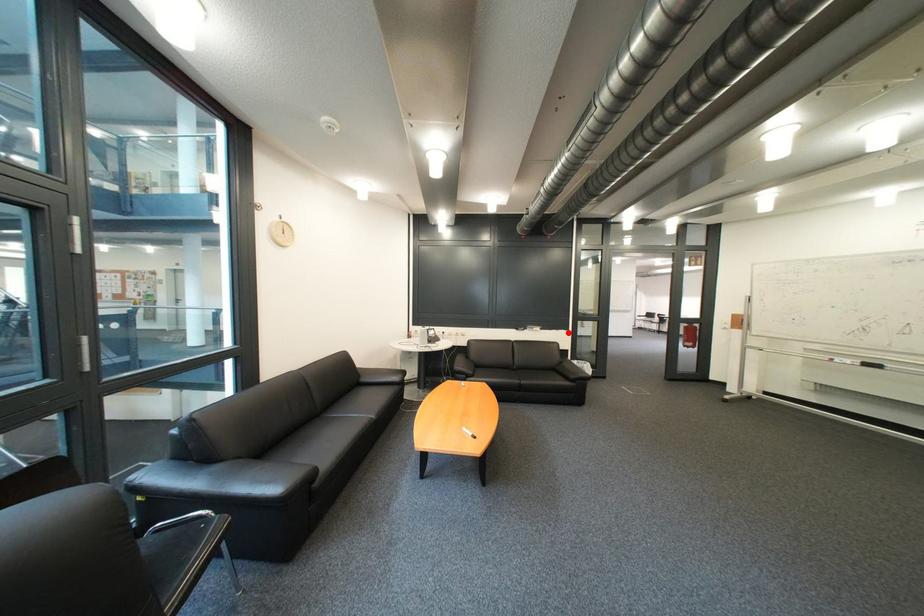
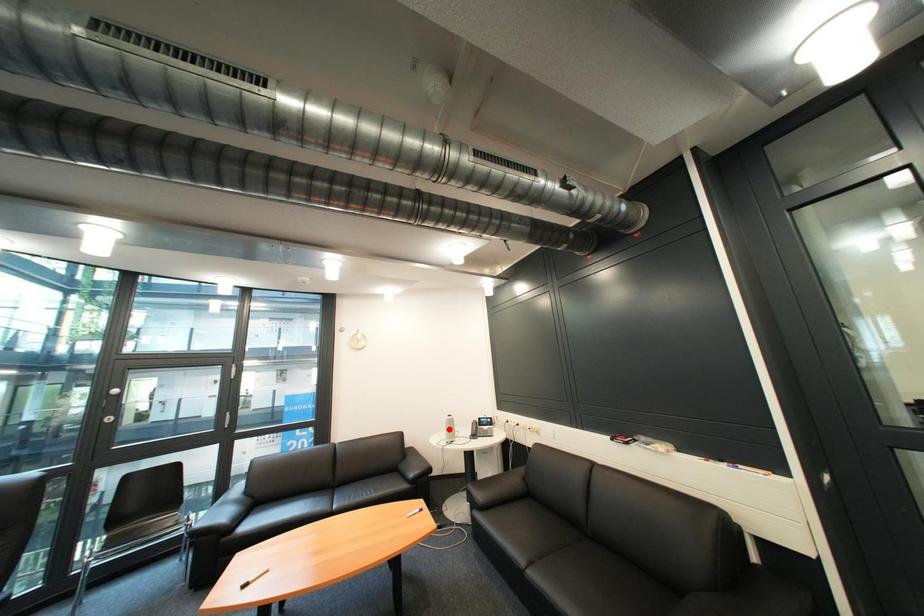
I am providing you with two images of the same scene from different viewpoints. A red point is marked on the first image and another point is marked on the second image. Does the point marked in image1 correspond to the same location as the one in image2?

No